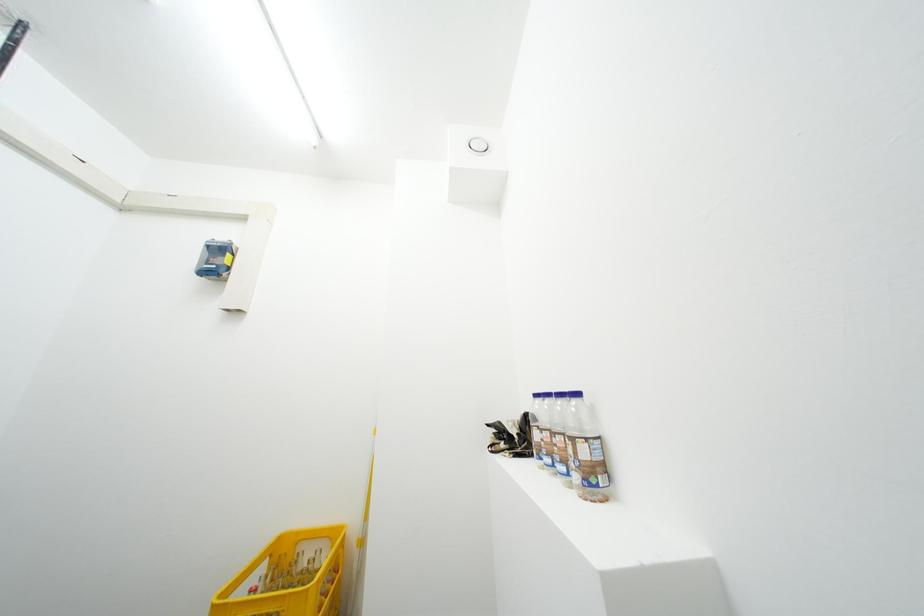
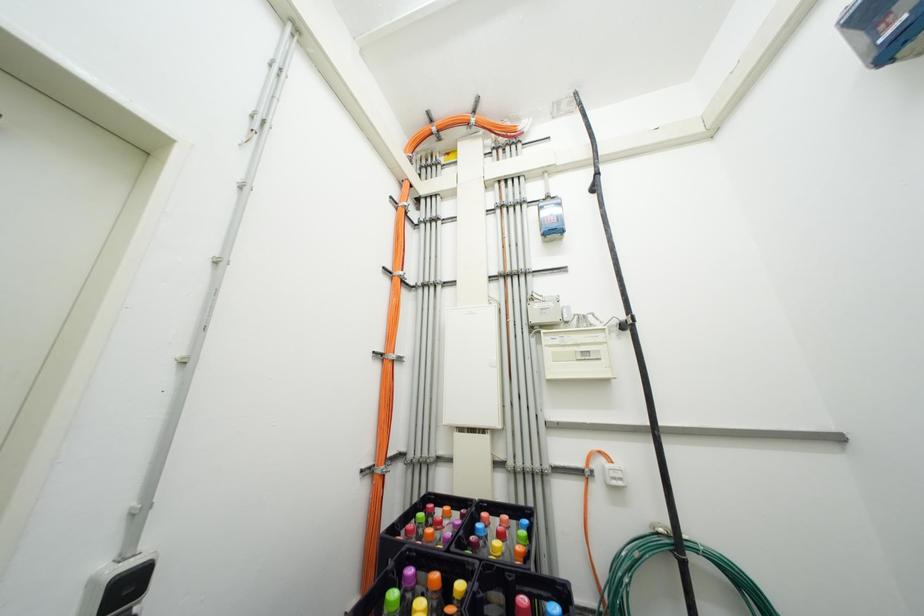
First-person continuous shooting, in which direction is the camera rotating?

The rotation direction of the camera is left-up.